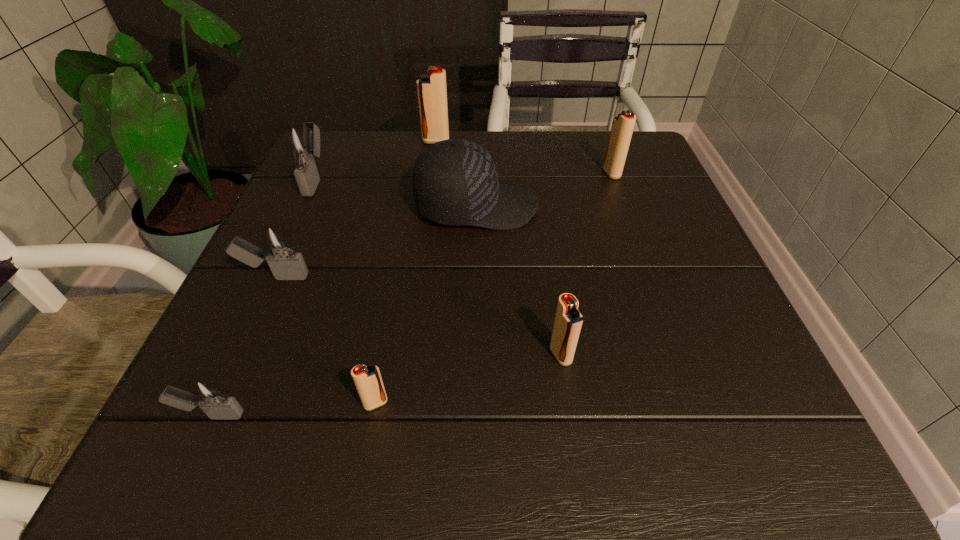
The height and width of the screenshot is (540, 960). I want to click on the biggest red igniter, so click(x=432, y=93).

The height and width of the screenshot is (540, 960). I want to click on the farthest object, so click(x=432, y=93).

Identify the location of the third nearest red igniter. Image resolution: width=960 pixels, height=540 pixels. (622, 128).

This screenshot has height=540, width=960. Find the location of `the third smallest red igniter`. the third smallest red igniter is located at coordinates (622, 128).

The width and height of the screenshot is (960, 540). I want to click on the farthest gray igniter, so click(x=301, y=142).

Locate an element on the screen. The height and width of the screenshot is (540, 960). baseball cap is located at coordinates (x=455, y=182).

Where is `the second farthest gray igniter`? the second farthest gray igniter is located at coordinates (279, 250).

Identify the location of the second smallest gray igniter. This screenshot has width=960, height=540. (279, 250).

Locate an element on the screen. the second nearest red igniter is located at coordinates (568, 321).

Where is `the third nearest igniter`? This screenshot has width=960, height=540. the third nearest igniter is located at coordinates (568, 321).